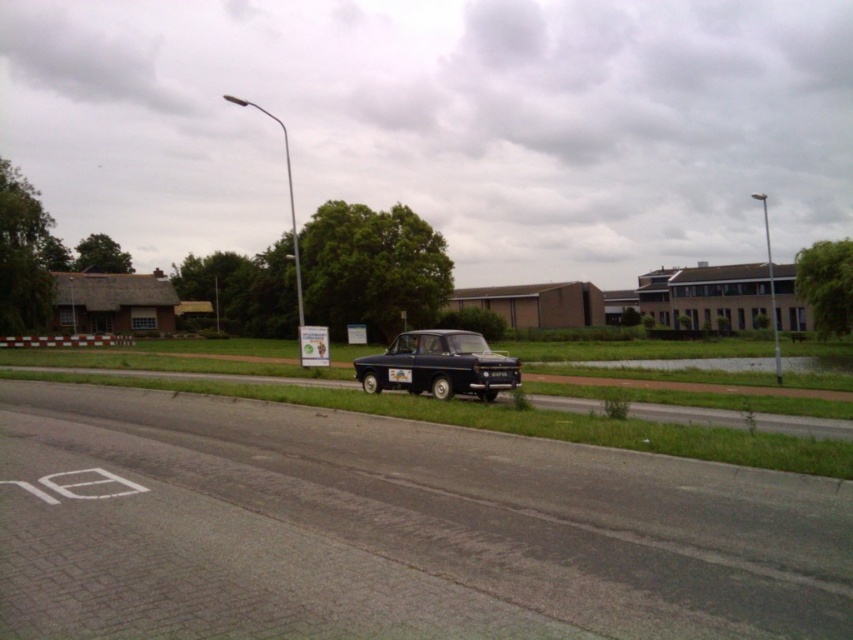
Question: Which point appears closest to the camera in this image?

Choices:
 (A) (299, 289)
 (B) (479, 349)

Answer: (B)

Question: Considering the relative positions of shiny blue car at center and metallic silver car at upper center in the image provided, where is shiny blue car at center located with respect to metallic silver car at upper center?

Choices:
 (A) left
 (B) right

Answer: (B)

Question: Considering the relative positions of shiny blue car at center and metallic silver car at upper center in the image provided, where is shiny blue car at center located with respect to metallic silver car at upper center?

Choices:
 (A) below
 (B) above

Answer: (A)

Question: Which point is farther from the camera taking this photo?

Choices:
 (A) (297, 259)
 (B) (422, 362)

Answer: (A)

Question: Is shiny blue car at center further to camera compared to metallic silver car at upper center?

Choices:
 (A) yes
 (B) no

Answer: (B)